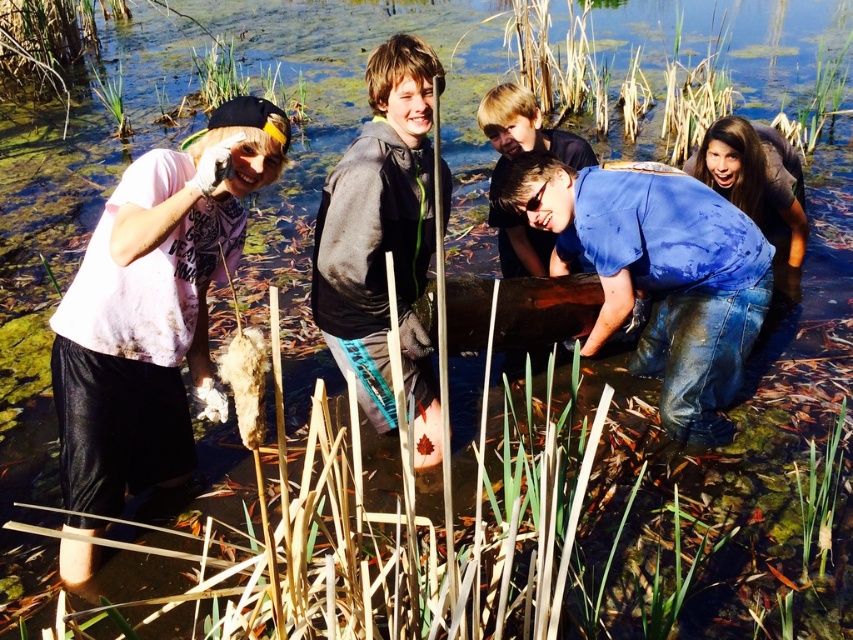
Question: Observing the image, what is the correct spatial positioning of blue tie-dye shirt at lower right in reference to blue denim jeans at center?

Choices:
 (A) right
 (B) left

Answer: (A)

Question: From the image, what is the correct spatial relationship of blue denim jeans at lower right in relation to blue tie-dye shirt at lower right?

Choices:
 (A) left
 (B) right

Answer: (A)

Question: Which object appears closest to the camera in this image?

Choices:
 (A) blue denim jeans at center
 (B) blue tie-dye shirt at lower right

Answer: (A)

Question: Which point appears farthest from the camera in this image?

Choices:
 (A) (680, 241)
 (B) (245, 147)
 (C) (576, 166)
 (D) (773, 284)

Answer: (D)

Question: Estimate the real-world distances between objects in this image. Which object is farther from the dark gray fleece jacket at center?

Choices:
 (A) blue denim jeans at center
 (B) blue denim jeans at lower right
 (C) matte pink shirt at left

Answer: (A)

Question: Does dark gray fleece jacket at center have a lesser width compared to blue tie-dye shirt at lower right?

Choices:
 (A) no
 (B) yes

Answer: (B)